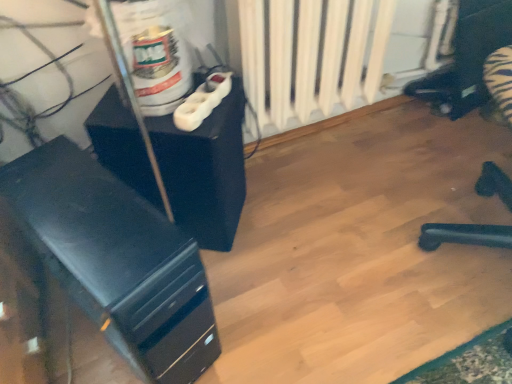
The width and height of the screenshot is (512, 384). Identify the location of vacant area that is situated to the right of matte black cabinet at center-left, placed as the first furniture when sorted from top to bottom. click(x=286, y=235).